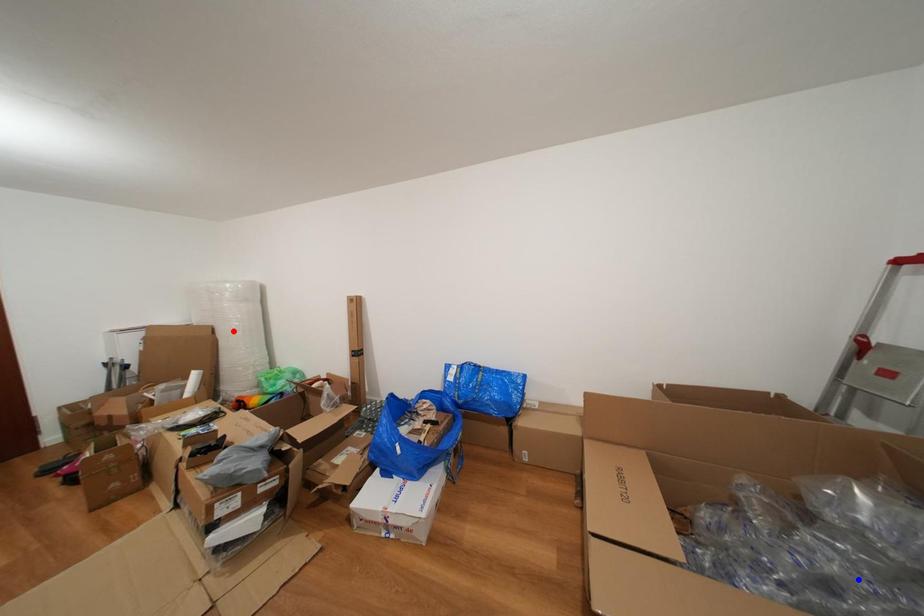
Question: Which of the two points in the image is closer to the camera?

Choices:
 (A) Blue point is closer.
 (B) Red point is closer.

Answer: (A)